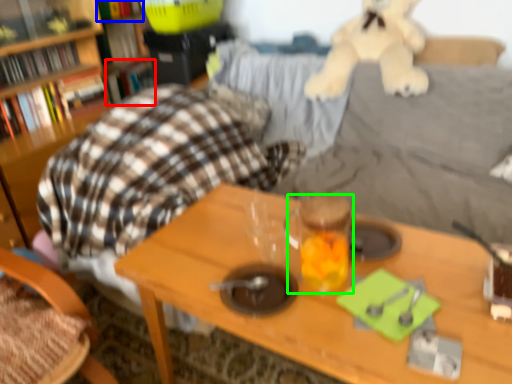
Question: Estimate the real-world distances between objects in this image. Which object is farther from book (highlighted by a red box), book (highlighted by a blue box) or beverage (highlighted by a green box)?

Choices:
 (A) book
 (B) beverage

Answer: (B)